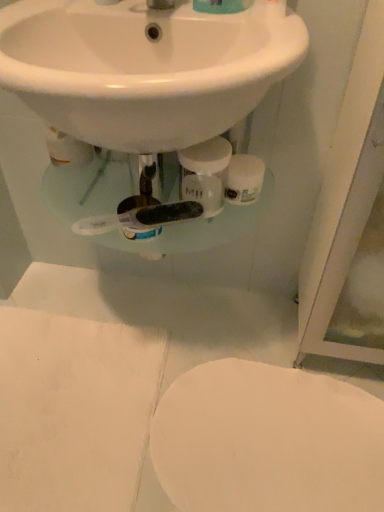
Question: From the image's perspective, is white glossy toilet at lower right above or below white glossy sink at upper center?

Choices:
 (A) below
 (B) above

Answer: (A)

Question: Is white glossy toilet at lower right wider or thinner than white glossy sink at upper center?

Choices:
 (A) thin
 (B) wide

Answer: (A)

Question: Which of these objects is positioned closest to the white matte toilet paper at center?

Choices:
 (A) white glossy toilet at lower right
 (B) white glossy sink at upper center

Answer: (B)

Question: Based on their relative distances, which object is nearer to the white glossy sink at upper center?

Choices:
 (A) white glossy toilet at lower right
 (B) white matte toilet paper at center

Answer: (B)